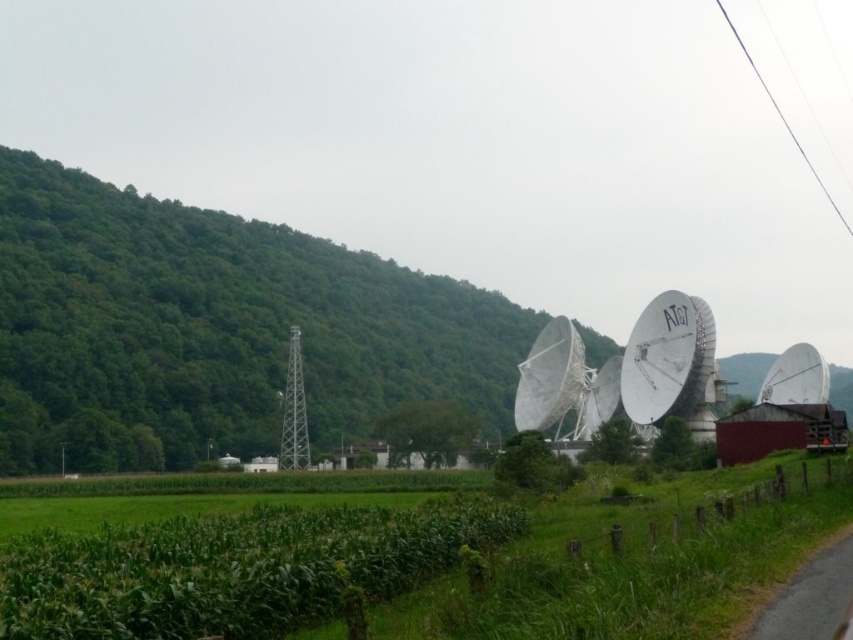
You are a farmer planning to plant a new crop in the green grassy corn field at center. You need to know if there is enough space between the field and the white metallic satellite at center to safely operate a tractor. Can you determine if the space between them is sufficient?

The green grassy corn field at center is bigger than the white metallic satellite at center, but the description does not provide specific measurements of the space between them. Therefore, it is unclear if there is enough room for a tractor to operate safely between them.

You are a farmer inspecting your crops and notice the green leafy corn at lower left and the white metallic satellite at center. Which of these two objects is smaller in size?

The green leafy corn at lower left has a smaller size compared to the white metallic satellite at center, so the green leafy corn at lower left is smaller.

You are a farmer who wants to plant new crops in the green grassy corn field at center. You need to ensure that the crops will not be obstructed by the white metallic satellite at center. Based on the image, can you determine if the field is positioned to the left or right of the satellite?

The green grassy corn field at center is positioned on the left side of the white metallic satellite at center, so the crops planted in the green grassy corn field at center will not be obstructed by the satellite as they are to its left.